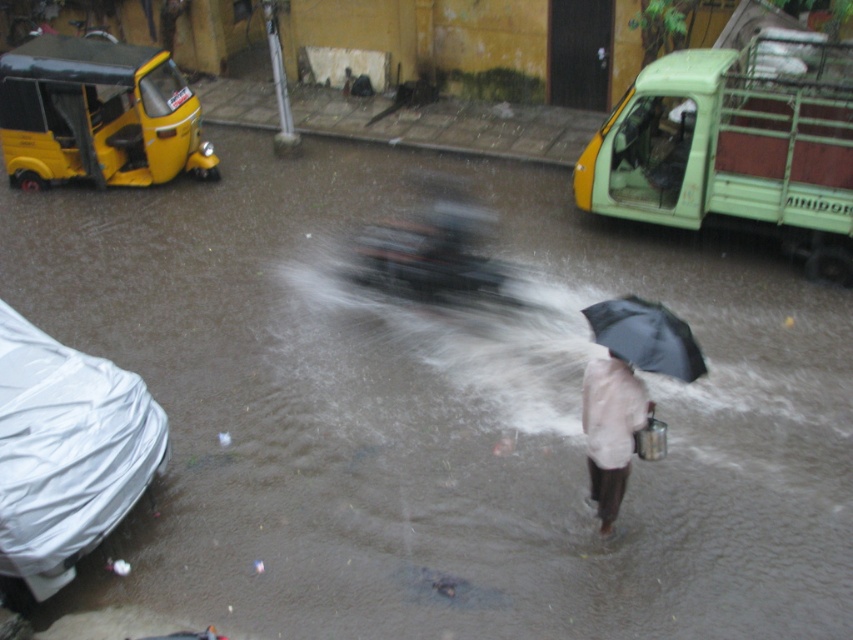
Question: Can you confirm if green matte truck at upper right is bigger than white plastic car at lower left?

Choices:
 (A) yes
 (B) no

Answer: (A)

Question: Among these objects, which one is nearest to the camera?

Choices:
 (A) white plastic car at lower left
 (B) black matte umbrella at center
 (C) white matte shirt at center
 (D) green matte truck at upper right

Answer: (B)

Question: Can you confirm if yellow matte auto-rickshaw at upper left is smaller than black matte umbrella at center?

Choices:
 (A) no
 (B) yes

Answer: (A)

Question: Among these points, which one is farthest from the camera?

Choices:
 (A) (621, 339)
 (B) (134, 410)

Answer: (B)

Question: Can you confirm if yellow matte auto-rickshaw at upper left is positioned to the right of white matte shirt at center?

Choices:
 (A) no
 (B) yes

Answer: (A)

Question: Which object is closer to the camera taking this photo?

Choices:
 (A) white matte shirt at center
 (B) yellow matte auto-rickshaw at upper left
 (C) white plastic car at lower left

Answer: (C)